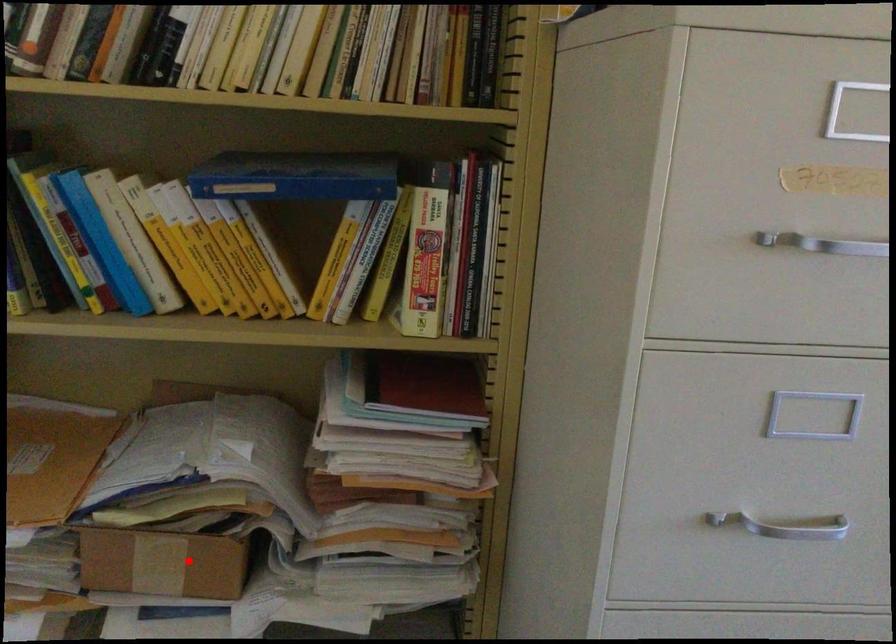
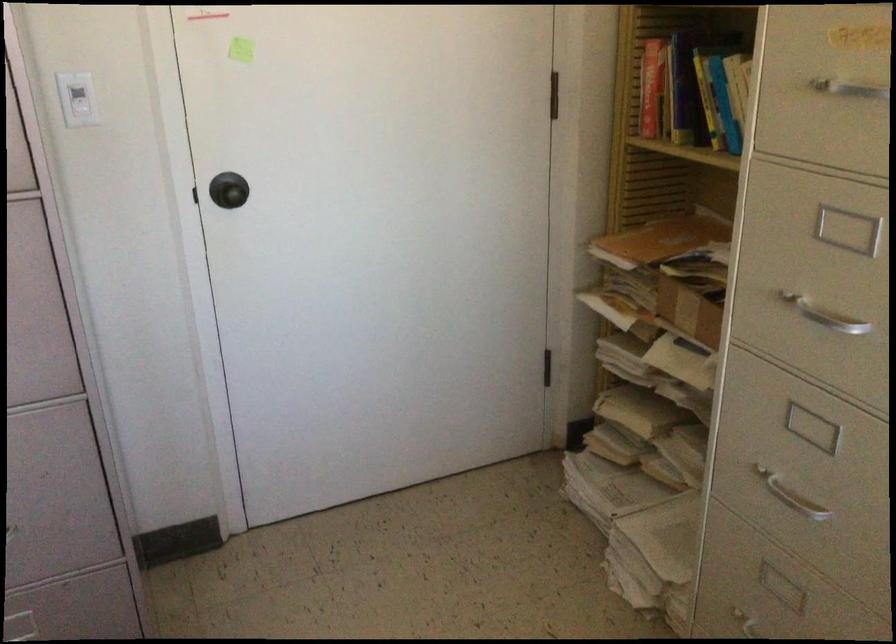
Question: I am providing you with two images of the same scene from different viewpoints. In image1, a red point is highlighted. Considering the same 3D point in image2, which of the following is correct?

Choices:
 (A) It is closer
 (B) It is farther

Answer: (B)